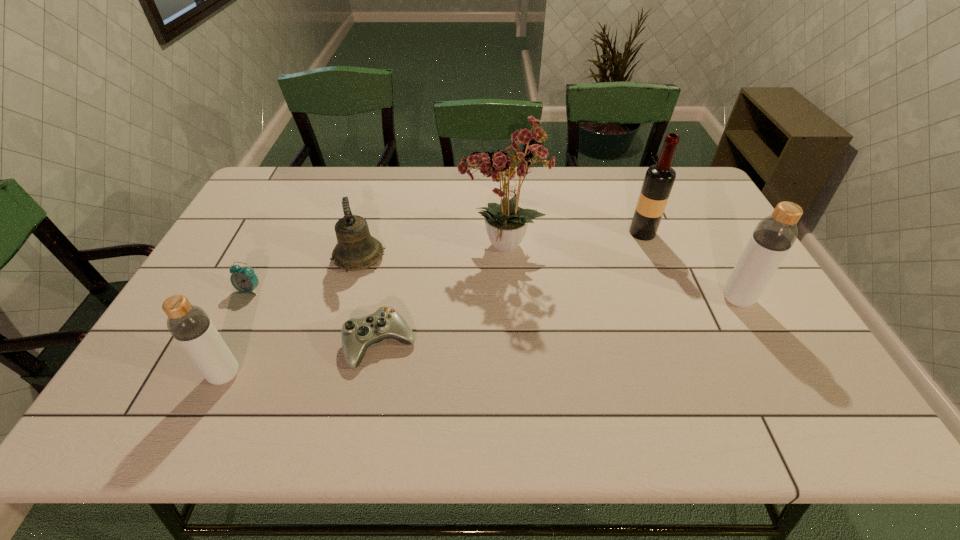
Locate an element on the screen. The image size is (960, 540). unoccupied area between the control and the rightmost object is located at coordinates (559, 321).

Where is `vacant space in between the taller bottle and the shorter bottle`? Image resolution: width=960 pixels, height=540 pixels. vacant space in between the taller bottle and the shorter bottle is located at coordinates (481, 337).

This screenshot has height=540, width=960. I want to click on vacant region between the fifth tallest object and the shorter bottle, so click(292, 316).

Locate an element on the screen. The image size is (960, 540). free point between the second shortest object and the shorter bottle is located at coordinates (237, 333).

You are a GUI agent. You are given a task and a screenshot of the screen. Output one action in this format:
    pyautogui.click(x=<x>, y=<y>)
    Task: Click on the vacant area that lies between the bell and the taller bottle
    
    Given the screenshot: What is the action you would take?
    pyautogui.click(x=548, y=278)

Where is `vacant area that lies between the tallest object and the fifth tallest object`? The image size is (960, 540). vacant area that lies between the tallest object and the fifth tallest object is located at coordinates (430, 252).

This screenshot has width=960, height=540. I want to click on vacant region between the fourth tallest object and the control, so click(x=302, y=360).

Locate an element on the screen. vacant space in between the tallest object and the second object from right to left is located at coordinates click(572, 240).

Image resolution: width=960 pixels, height=540 pixels. Identify the location of vacant space in between the control and the wine bottle. (512, 288).

I want to click on vacant area between the sixth tallest object and the flower arrangement, so click(x=376, y=269).